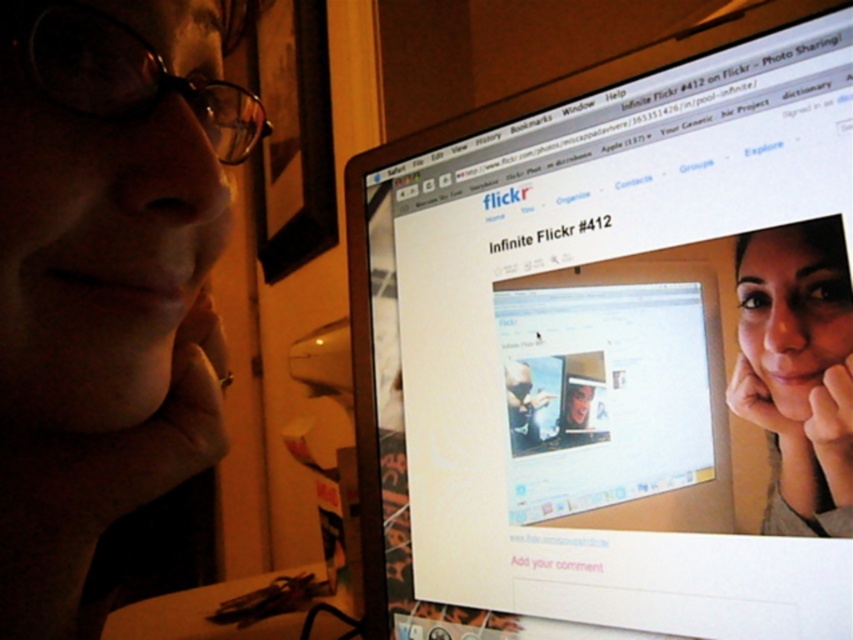
Which is below, white glossy monitor at upper center or matte skin face at center?

matte skin face at center is below.

How much distance is there between white glossy monitor at upper center and matte skin face at center?

white glossy monitor at upper center is 5.45 inches from matte skin face at center.

What are the coordinates of `white glossy monitor at upper center` in the screenshot? It's located at (614, 348).

The image size is (853, 640). I want to click on white glossy monitor at upper center, so click(614, 348).